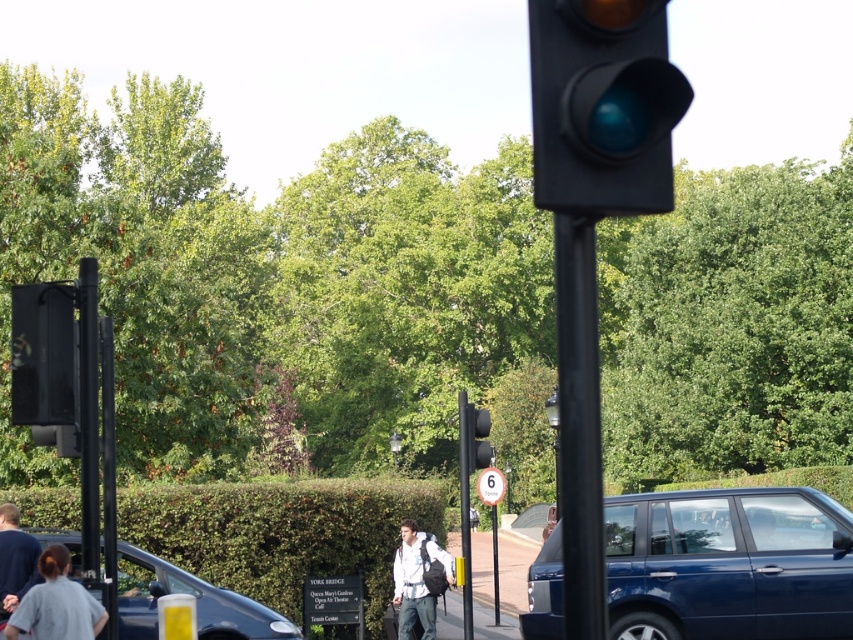
You are standing at point (579, 428) in the scene. What object is located exactly at your current position?

The black metal pole at center is located exactly at point (579, 428).

You are a delivery driver needing to park your vehicle near the shiny blue suv at lower right and the metallic pole at center. Based on their sizes, which one would require more space to park around?

The metallic pole at center requires more space to park around because the shiny blue suv at lower right occupies less space than it.

You are a delivery person trying to park your 2.5 meters wide van. You see the shiny blue suv at lower right and the metallic pole at center. Which object has a larger width to consider for parking your van?

The shiny blue suv at lower right has a larger width than the metallic pole at center. Since the suv is wider, you should ensure there is enough space between it and other objects to accommodate your van.